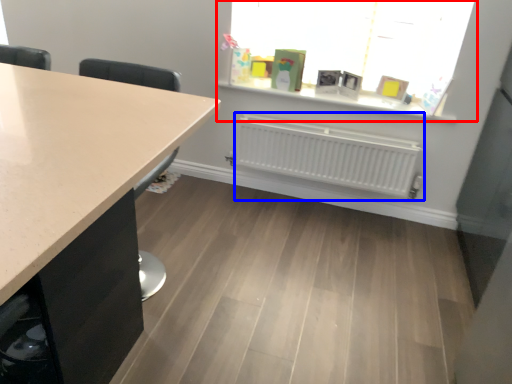
Question: Which object is closer to the camera taking this photo, window (highlighted by a red box) or radiator (highlighted by a blue box)?

Choices:
 (A) window
 (B) radiator

Answer: (A)